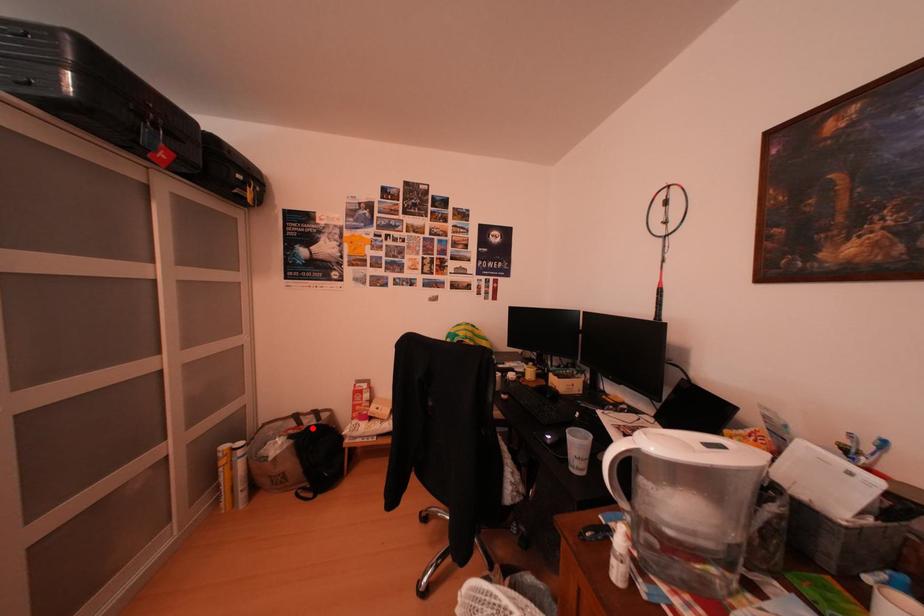
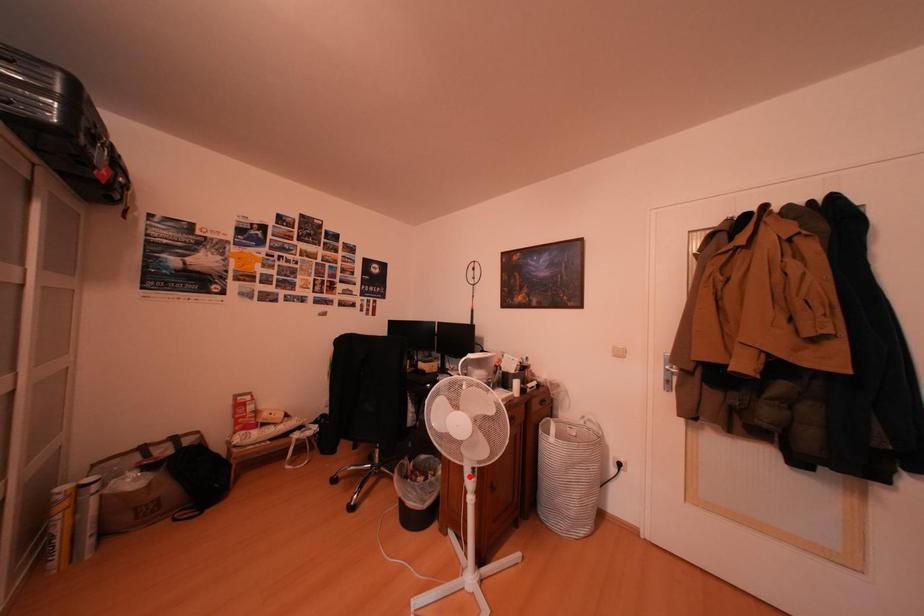
I am providing you with two images of the same scene from different viewpoints. A red point is marked on the first image and another point is marked on the second image. Does the point marked in image1 correspond to the same location as the one in image2?

No